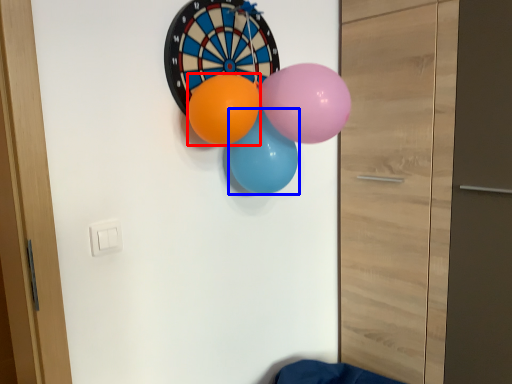
Question: Among these objects, which one is farthest to the camera, balloon (highlighted by a red box) or balloon (highlighted by a blue box)?

Choices:
 (A) balloon
 (B) balloon

Answer: (B)